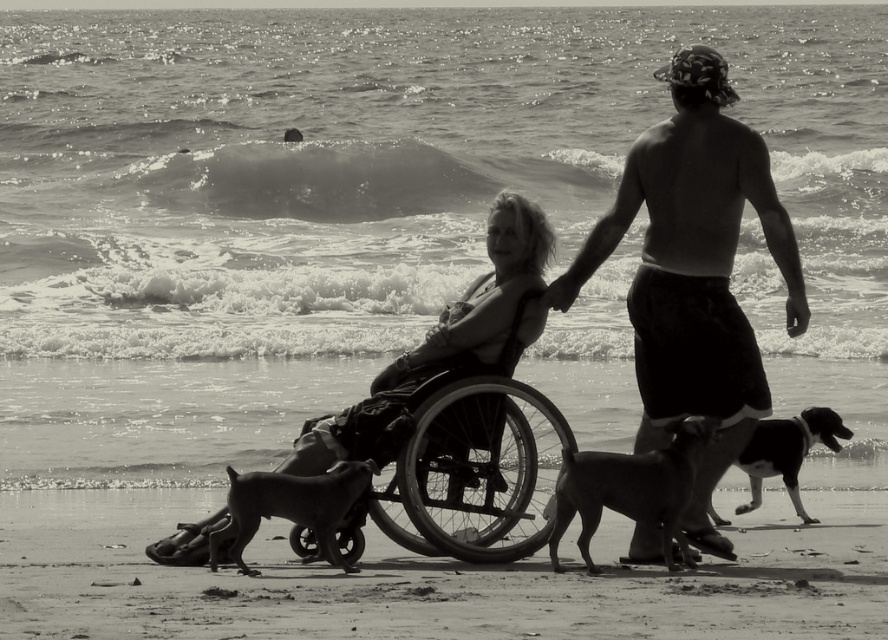
Between smooth brown dog at lower right and smooth black dog at lower left, which one appears on the left side from the viewer's perspective?

From the viewer's perspective, smooth black dog at lower left appears more on the left side.

What do you see at coordinates (631, 490) in the screenshot?
I see `smooth brown dog at lower right` at bounding box center [631, 490].

Identify the location of smooth brown dog at lower right. The image size is (888, 640). (631, 490).

Which is in front, point (259, 508) or point (751, 476)?

Positioned in front is point (259, 508).

Measure the distance between smooth black dog at lower left and camera.

smooth black dog at lower left is 57.80 feet from camera.

Does point (358, 481) come farther from viewer compared to point (770, 444)?

No.

The height and width of the screenshot is (640, 888). Identify the location of smooth black dog at lower left. (291, 508).

Who is positioned more to the right, smooth brown dog at lower right or black and white fur dog at lower right?

black and white fur dog at lower right is more to the right.

Does smooth brown dog at lower right appear on the left side of black and white fur dog at lower right?

Yes, smooth brown dog at lower right is to the left of black and white fur dog at lower right.

Image resolution: width=888 pixels, height=640 pixels. What do you see at coordinates (631, 490) in the screenshot? I see `smooth brown dog at lower right` at bounding box center [631, 490].

This screenshot has width=888, height=640. Find the location of `smooth brown dog at lower right`. smooth brown dog at lower right is located at coordinates (631, 490).